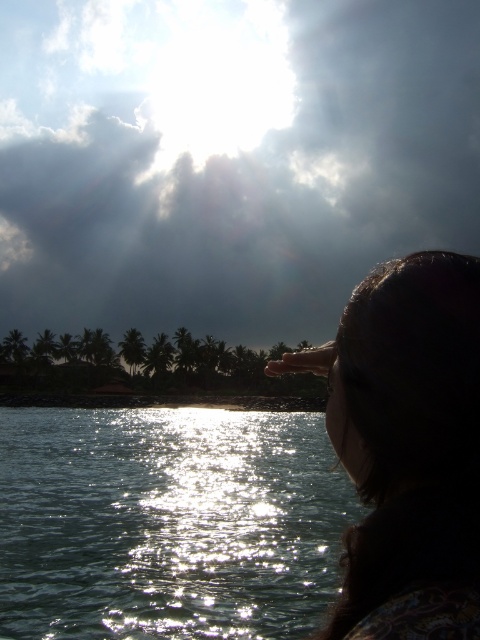
Question: Which point appears farthest from the camera in this image?

Choices:
 (A) (24, 148)
 (B) (301, 484)
 (C) (457, 440)

Answer: (A)

Question: Does sparkling silver water at lower left lie behind silhouette hair at upper right?

Choices:
 (A) yes
 (B) no

Answer: (A)

Question: Which is farther from the sparkling silver water at lower left?

Choices:
 (A) cloudy sky at upper center
 (B) silhouette hair at upper right

Answer: (A)

Question: Which point is farther to the camera?

Choices:
 (A) (20, 600)
 (B) (391, 369)
 (C) (419, 40)

Answer: (C)

Question: Does sparkling silver water at lower left have a greater width compared to silhouette hair at upper right?

Choices:
 (A) yes
 (B) no

Answer: (A)

Question: Can you confirm if cloudy sky at upper center is thinner than silhouette hair at upper right?

Choices:
 (A) yes
 (B) no

Answer: (B)